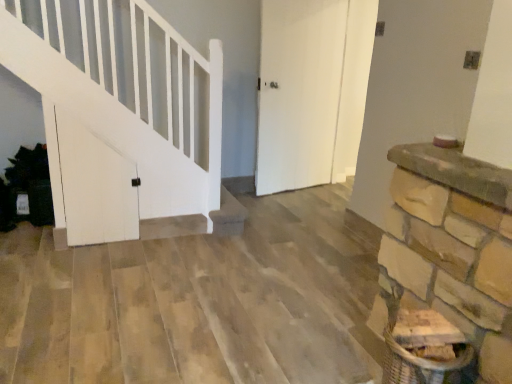
Describe the element at coordinates (298, 92) in the screenshot. The height and width of the screenshot is (384, 512). I see `white matte door at center, the 1th door positioned from the right` at that location.

The width and height of the screenshot is (512, 384). What are the coordinates of `white matte door at center, which is the 2th door in left-to-right order` in the screenshot? It's located at (298, 92).

What do you see at coordinates (95, 186) in the screenshot? This screenshot has width=512, height=384. I see `white matte door at left, the 1th door positioned from the front` at bounding box center [95, 186].

What is the approximate height of white matte door at left, the 2th door from the right?

3.37 feet.

Image resolution: width=512 pixels, height=384 pixels. Find the location of `white matte door at left, the 1th door positioned from the front`. white matte door at left, the 1th door positioned from the front is located at coordinates (95, 186).

Identify the location of white matte door at center, the second door positioned from the front. (298, 92).

Can you confirm if white matte door at left, the 2th door from the back, is positioned to the left of white matte door at center, the 1th door positioned from the right?

Correct, you'll find white matte door at left, the 2th door from the back, to the left of white matte door at center, the 1th door positioned from the right.

Which object is closer to the camera taking this photo, white matte door at left, the 2th door from the right, or white matte door at center, which is the 2th door in left-to-right order?

Positioned in front is white matte door at left, the 2th door from the right.

Which is closer to the camera, (77, 146) or (331, 29)?

The point (77, 146) is more forward.

From the image's perspective, is white matte door at left, the 2th door from the right, above or below white matte door at center, which is the 2th door in left-to-right order?

white matte door at left, the 2th door from the right, is below white matte door at center, which is the 2th door in left-to-right order.

From a real-world perspective, which object stands above the other?

white matte door at center, which is the 2th door in left-to-right order, from a real-world perspective.

Between white matte door at left, the 2th door from the back, and white matte door at center, which is the 2th door in left-to-right order, which one has larger width?

With larger width is white matte door at center, which is the 2th door in left-to-right order.

Is white matte door at left, the 2th door from the back, taller or shorter than white matte door at center, the 1th door viewed from the back?

Clearly, white matte door at left, the 2th door from the back, is shorter compared to white matte door at center, the 1th door viewed from the back.

Considering the relative sizes of white matte door at left, the 1th door positioned from the front, and white matte door at center, the 1th door positioned from the right, in the image provided, is white matte door at left, the 1th door positioned from the front, bigger than white matte door at center, the 1th door positioned from the right,?

Actually, white matte door at left, the 1th door positioned from the front, might be smaller than white matte door at center, the 1th door positioned from the right.

Consider the image. Can we say white matte door at left, the 2th door from the right, lies outside white matte door at center, the second door positioned from the front?

Yes, white matte door at left, the 2th door from the right, is outside of white matte door at center, the second door positioned from the front.

Are white matte door at left, the 2th door from the back, and white matte door at center, the 1th door positioned from the right, located far from each other?

white matte door at left, the 2th door from the back, is positioned a significant distance from white matte door at center, the 1th door positioned from the right.

Could you tell me if white matte door at left, the 2th door from the right, is turned towards white matte door at center, the 1th door viewed from the back?

No, white matte door at left, the 2th door from the right, is not turned towards white matte door at center, the 1th door viewed from the back.

How different are the orientations of white matte door at left, the 2th door from the right, and white matte door at center, the 1th door positioned from the right, in degrees?

They differ by 11 degrees in their facing directions.

You are a GUI agent. You are given a task and a screenshot of the screen. Output one action in this format:
    pyautogui.click(x=<x>, y=<y>)
    Task: Click on the door above the white matte door at left, the 2th door from the right (from a real-world perspective)
    
    Given the screenshot: What is the action you would take?
    pyautogui.click(x=298, y=92)

Considering the relative positions of white matte door at center, the 1th door positioned from the right, and white matte door at left, the 2th door from the back, in the image provided, is white matte door at center, the 1th door positioned from the right, to the left of white matte door at left, the 2th door from the back, from the viewer's perspective?

Incorrect, white matte door at center, the 1th door positioned from the right, is not on the left side of white matte door at left, the 2th door from the back.

Relative to white matte door at left, the 1th door when ordered from left to right, is white matte door at center, the 1th door positioned from the right, in front or behind?

Clearly, white matte door at center, the 1th door positioned from the right, is behind white matte door at left, the 1th door when ordered from left to right.

Which is closer, (317, 0) or (114, 170)?

Point (317, 0).

From the image's perspective, who appears lower, white matte door at center, the 1th door positioned from the right, or white matte door at left, the 2th door from the back?

white matte door at left, the 2th door from the back, from the image's perspective.

Looking at this image, from a real-world perspective, between white matte door at center, the 1th door viewed from the back, and white matte door at left, the 1th door positioned from the front, who is vertically higher?

white matte door at center, the 1th door viewed from the back, is physically above.

Does white matte door at center, which is the 2th door in left-to-right order, have a greater width compared to white matte door at left, the 1th door when ordered from left to right?

Correct, the width of white matte door at center, which is the 2th door in left-to-right order, exceeds that of white matte door at left, the 1th door when ordered from left to right.

From their relative heights in the image, would you say white matte door at center, the 1th door positioned from the right, is taller or shorter than white matte door at left, the 2th door from the right?

white matte door at center, the 1th door positioned from the right, is taller than white matte door at left, the 2th door from the right.

Does white matte door at center, which is the 2th door in left-to-right order, have a larger size compared to white matte door at left, the 2th door from the right?

Indeed, white matte door at center, which is the 2th door in left-to-right order, has a larger size compared to white matte door at left, the 2th door from the right.

Is white matte door at center, the second door positioned from the front, not within white matte door at left, the 1th door when ordered from left to right?

Absolutely, white matte door at center, the second door positioned from the front, is external to white matte door at left, the 1th door when ordered from left to right.

Is the surface of white matte door at center, the 1th door positioned from the right, in direct contact with white matte door at left, the 1th door when ordered from left to right?

No, white matte door at center, the 1th door positioned from the right, is not with white matte door at left, the 1th door when ordered from left to right.

Is white matte door at center, the 1th door positioned from the right, oriented towards white matte door at left, the 2th door from the back?

No.

How many degrees apart are the facing directions of white matte door at center, the 1th door viewed from the back, and white matte door at left, the 2th door from the right?

The angular difference between white matte door at center, the 1th door viewed from the back, and white matte door at left, the 2th door from the right, is 11 degrees.

Where is `door below the white matte door at center, the 1th door positioned from the right (from a real-world perspective)`? The height and width of the screenshot is (384, 512). door below the white matte door at center, the 1th door positioned from the right (from a real-world perspective) is located at coordinates (95, 186).

What are the coordinates of `door that is in front of the white matte door at center, the second door positioned from the front` in the screenshot? It's located at (95, 186).

Where is `door above the white matte door at left, the 2th door from the back (from the image's perspective)`? The width and height of the screenshot is (512, 384). door above the white matte door at left, the 2th door from the back (from the image's perspective) is located at coordinates (298, 92).